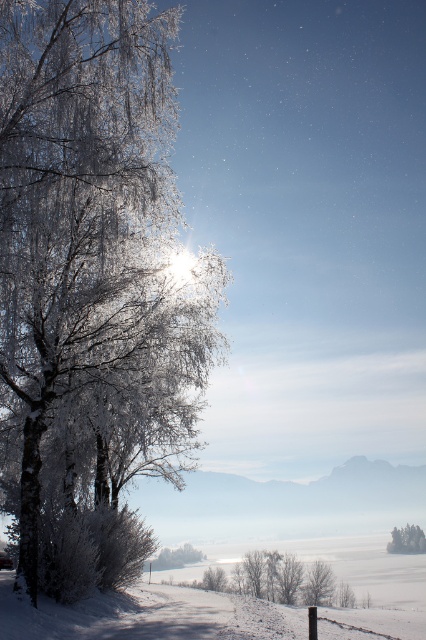
Does white frosty tree at lower center appear on the right side of white frosty tree at lower right?

In fact, white frosty tree at lower center is to the left of white frosty tree at lower right.

Who is shorter, white frosty tree at lower center or white frosty tree at lower right?

white frosty tree at lower center

Where is `white frosty tree at lower center`? The height and width of the screenshot is (640, 426). white frosty tree at lower center is located at coordinates (175, 557).

Is frosted glass tree at left in front of white frosty tree at lower right?

That is True.

Does frosted glass tree at left have a greater width compared to white frosty tree at lower right?

Yes.

Identify the location of frosted glass tree at left. The height and width of the screenshot is (640, 426). (78, 205).

Is frosted glass tree at left thinner than white frosty tree at lower center?

No.

Which is in front, point (89, 163) or point (186, 556)?

Point (89, 163) is more forward.

Find the location of a particular element. The image size is (426, 640). frosted glass tree at left is located at coordinates (78, 205).

At what (x,y) coordinates should I click in order to perform the action: click on frosted glass tree at left. Please return your answer as a coordinate pair (x, y). The image size is (426, 640). Looking at the image, I should click on (78, 205).